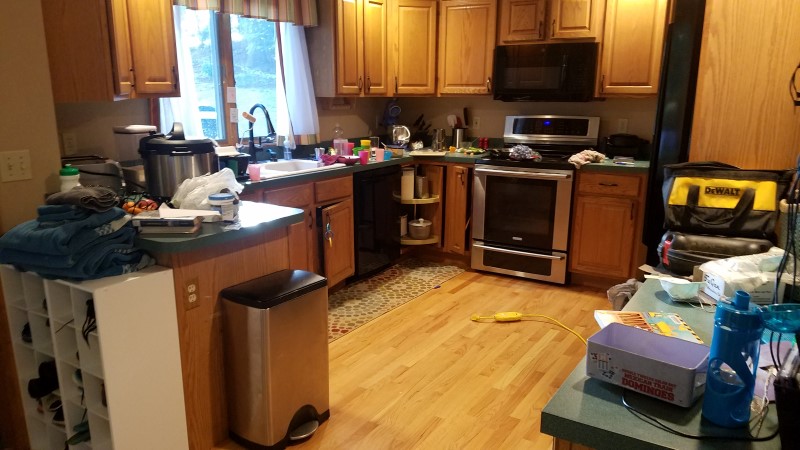
This screenshot has height=450, width=800. Find the location of `curtain`. curtain is located at coordinates (296, 91).